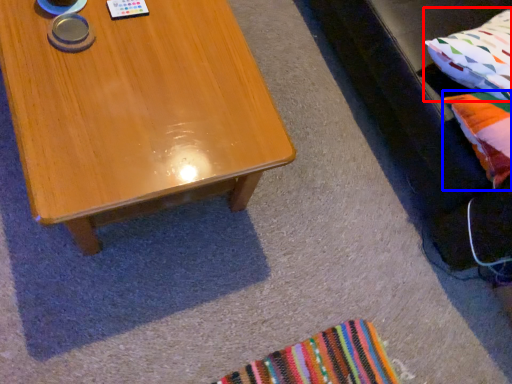
Question: Among these objects, which one is nearest to the camera, pillow (highlighted by a red box) or pillow (highlighted by a blue box)?

Choices:
 (A) pillow
 (B) pillow

Answer: (B)